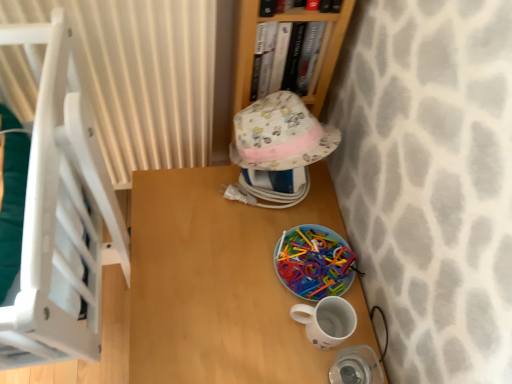
Question: Considering the relative sizes of fluffy cotton hat at center and hardcover book at upper center in the image provided, is fluffy cotton hat at center bigger than hardcover book at upper center?

Choices:
 (A) no
 (B) yes

Answer: (B)

Question: From a real-world perspective, is fluffy cotton hat at center on top of hardcover book at upper center?

Choices:
 (A) no
 (B) yes

Answer: (A)

Question: Considering the relative sizes of fluffy cotton hat at center and hardcover book at upper center in the image provided, is fluffy cotton hat at center wider than hardcover book at upper center?

Choices:
 (A) yes
 (B) no

Answer: (A)

Question: From the image's perspective, is fluffy cotton hat at center over hardcover book at upper center?

Choices:
 (A) no
 (B) yes

Answer: (A)

Question: Does fluffy cotton hat at center appear on the right side of hardcover book at upper center?

Choices:
 (A) yes
 (B) no

Answer: (B)

Question: Does fluffy cotton hat at center have a smaller size compared to hardcover book at upper center?

Choices:
 (A) yes
 (B) no

Answer: (B)

Question: Is beige striped curtain at upper left at the left side of white glossy mug at lower right?

Choices:
 (A) yes
 (B) no

Answer: (A)

Question: Considering the relative sizes of beige striped curtain at upper left and white glossy mug at lower right in the image provided, is beige striped curtain at upper left bigger than white glossy mug at lower right?

Choices:
 (A) yes
 (B) no

Answer: (A)

Question: From the image's perspective, does beige striped curtain at upper left appear higher than white glossy mug at lower right?

Choices:
 (A) yes
 (B) no

Answer: (A)

Question: Considering the relative sizes of beige striped curtain at upper left and white glossy mug at lower right in the image provided, is beige striped curtain at upper left taller than white glossy mug at lower right?

Choices:
 (A) no
 (B) yes

Answer: (B)

Question: Is beige striped curtain at upper left not inside white glossy mug at lower right?

Choices:
 (A) no
 (B) yes

Answer: (B)

Question: Is beige striped curtain at upper left shorter than white glossy mug at lower right?

Choices:
 (A) no
 (B) yes

Answer: (A)

Question: From the image's perspective, is fluffy cotton hat at center on wooden bookshelf at upper center?

Choices:
 (A) yes
 (B) no

Answer: (B)